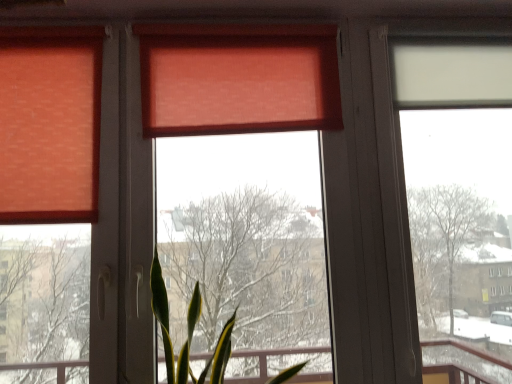
Question: Is matte orange curtain at upper center inside the boundaries of matte orange window screen at center, which is the 1th window screen from left to right, or outside?

Choices:
 (A) inside
 (B) outside

Answer: (A)

Question: From the image's perspective, relative to matte orange window screen at center, which is the 1th window screen from left to right, is matte orange curtain at upper center above or below?

Choices:
 (A) above
 (B) below

Answer: (A)

Question: Which of these objects is positioned farthest from the matte orange window screen at center, which is the 1th window screen from left to right?

Choices:
 (A) matte orange curtain at upper center
 (B) transparent plastic window screen at right, which is the 2th window screen from left to right

Answer: (B)

Question: Which is farther from the transparent plastic window screen at right, which is the 1th window screen from right to left?

Choices:
 (A) matte orange window screen at center, which is the 1th window screen from left to right
 (B) matte orange curtain at upper center

Answer: (B)